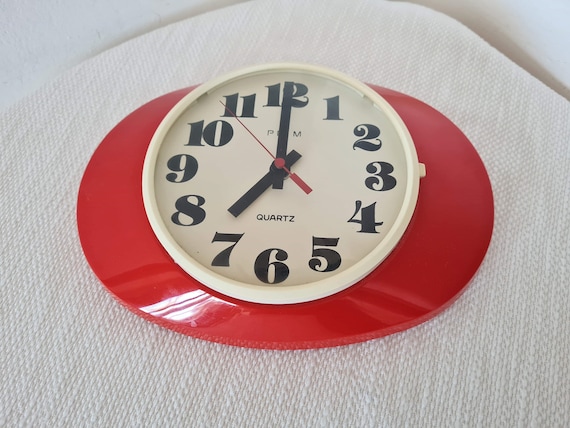
Identify the location of clock face. coord(319,171).